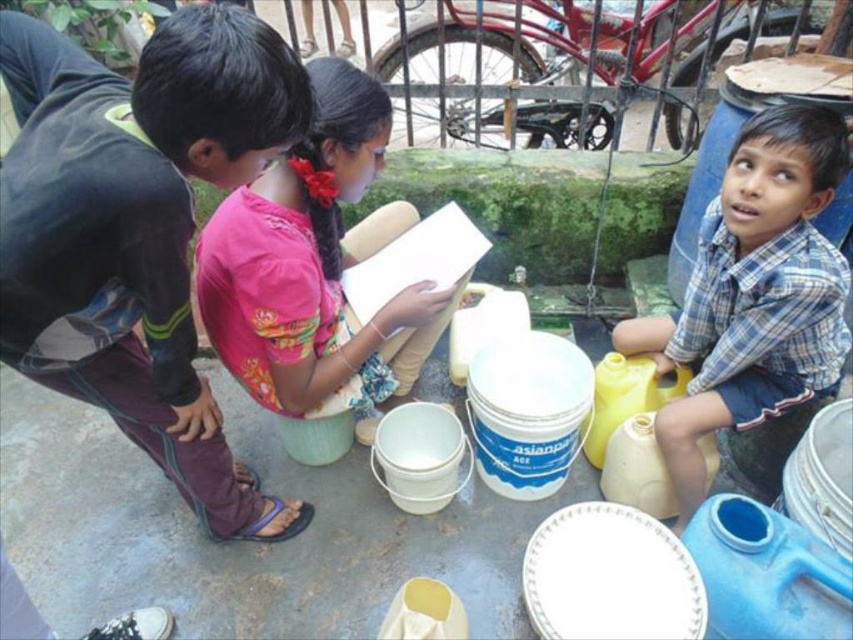
Question: Does dark purple pants at left appear over blue plaid shirt at center?

Choices:
 (A) yes
 (B) no

Answer: (B)

Question: Which object appears closest to the camera in this image?

Choices:
 (A) dark purple pants at left
 (B) pink fabric shirt at center
 (C) blue plaid shirt at center

Answer: (A)

Question: Which of these objects is positioned closest to the pink fabric shirt at center?

Choices:
 (A) dark purple pants at left
 (B) blue plaid shirt at center

Answer: (A)

Question: Which object is the closest to the dark purple pants at left?

Choices:
 (A) pink fabric shirt at center
 (B) blue plaid shirt at center

Answer: (A)

Question: Does dark purple pants at left have a greater width compared to blue plaid shirt at center?

Choices:
 (A) yes
 (B) no

Answer: (A)

Question: Can you confirm if pink fabric shirt at center is positioned to the left of blue plaid shirt at center?

Choices:
 (A) yes
 (B) no

Answer: (A)